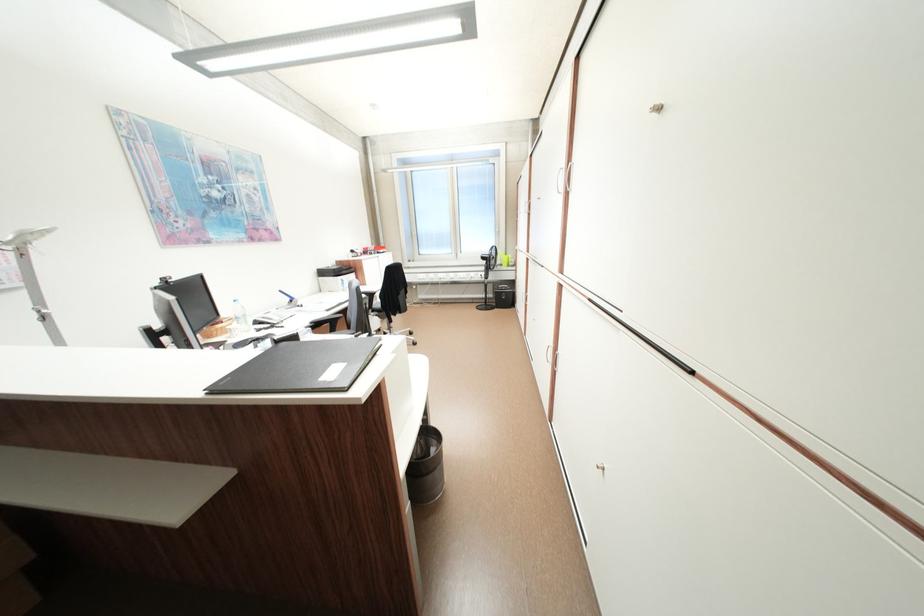
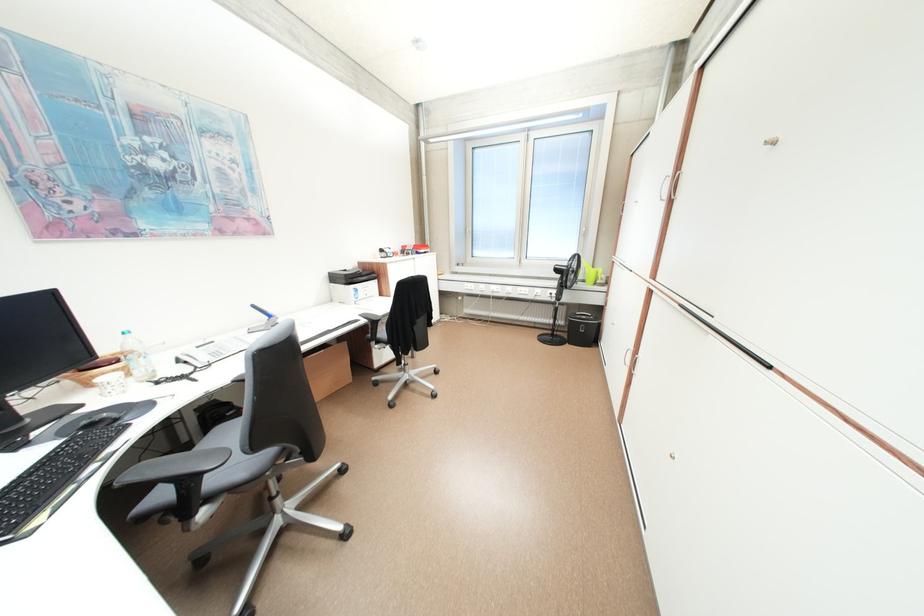
Where in the second image is the point corresponding to point (494, 306) from the first image?

(561, 338)